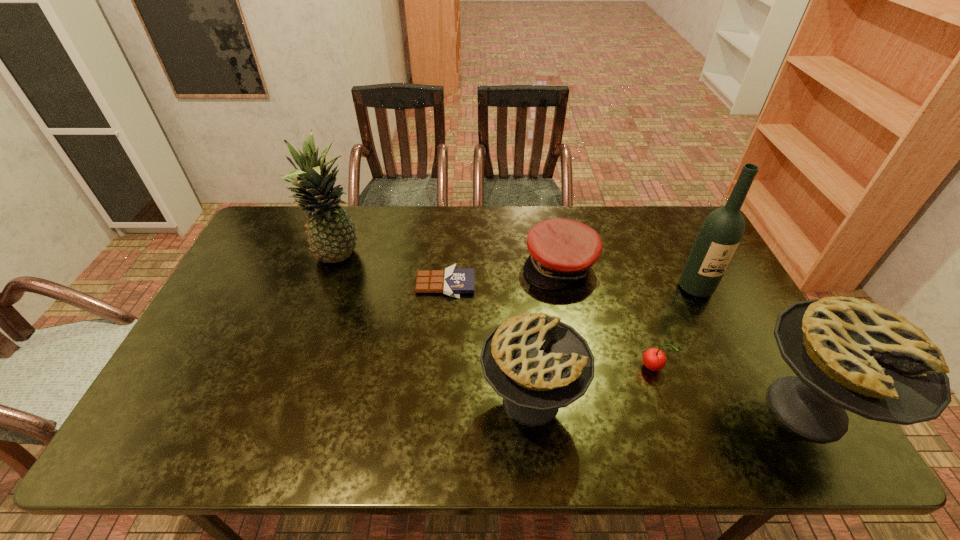
Find the location of `vacant space that satisfies the following two spatial constraints: 1. at the front of the cap where the visor is located; 2. on the cut side of the shorter pie`. vacant space that satisfies the following two spatial constraints: 1. at the front of the cap where the visor is located; 2. on the cut side of the shorter pie is located at coordinates (586, 401).